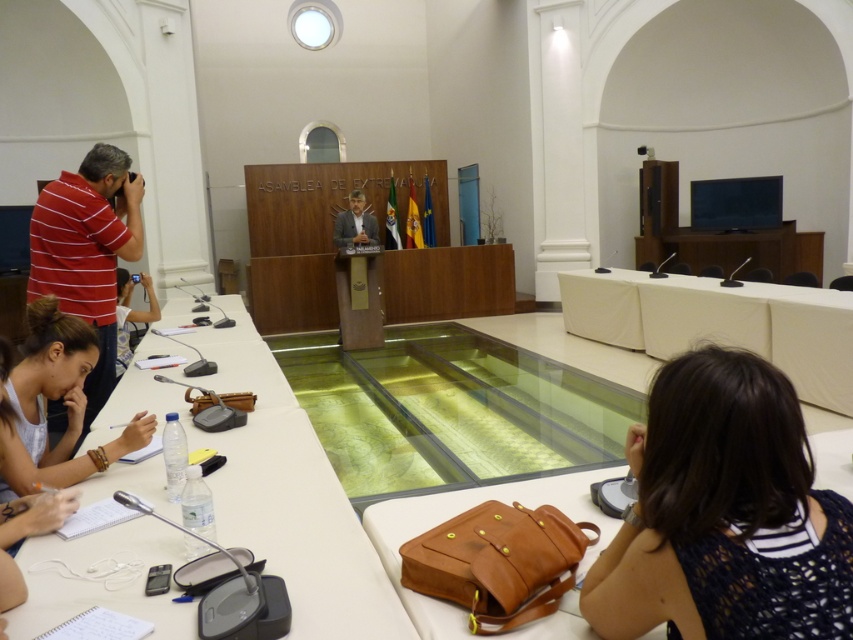
You are attending a formal meeting at the ASAMBLEA DE EXTREMADURA. You need to locate the striped cotton shirt at left and the brown leather bag at lower center. Which object is positioned higher in the image?

The striped cotton shirt at left is above the brown leather bag at lower center, so the striped cotton shirt at left is positioned higher in the image.

You are standing in the room and want to reach the point marked as point (68,284). If your walking speed is 3 feet per second, how many seconds will it take you to reach that point?

The point (68,284) is 9.50 feet away from the viewer. At a walking speed of 3 feet per second, it will take approximately 3.17 seconds to reach the point.

You are a photographer standing at the back of the room during the meeting. You need to capture a closeup shot of the brown leather bag at lower center. Based on its position coordinates, can you estimate whether it will be in the center of your camera frame or off to one side?

The brown leather bag at lower center is positioned at coordinates point (467, 508), which places it closer to the right side of the frame rather than the exact center. Therefore, it will appear off to the right side in the camera frame.